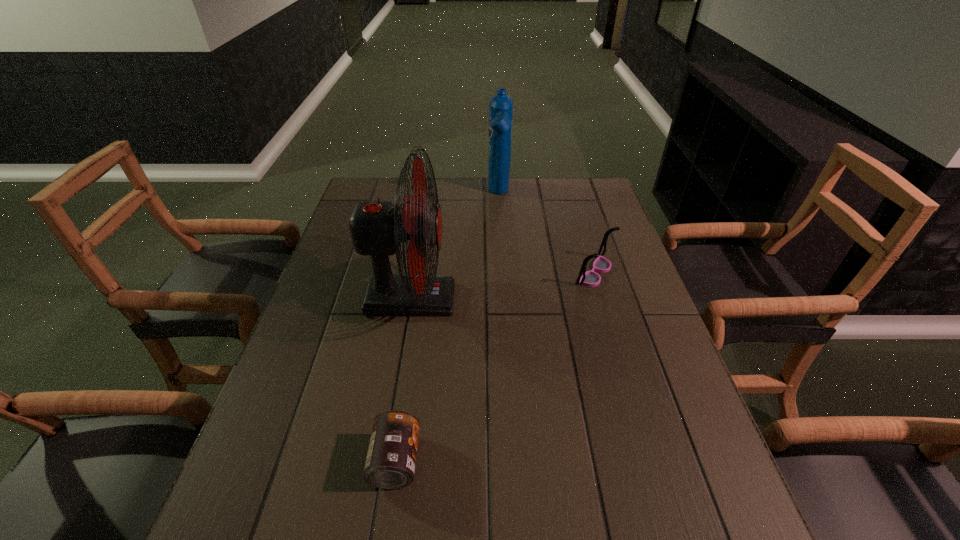
Where is `vacant space that is in between the nearest object and the tallest object`? The width and height of the screenshot is (960, 540). vacant space that is in between the nearest object and the tallest object is located at coordinates 403,380.

In order to click on free point between the fan and the nearest object in this screenshot , I will do `click(403, 380)`.

Identify the location of vacant space that's between the third tallest object and the third object from left to right. The width and height of the screenshot is (960, 540). (546, 233).

The image size is (960, 540). Identify the location of vacant area that lies between the shortest object and the farthest object. (x=447, y=327).

This screenshot has width=960, height=540. I want to click on free spot between the nearest object and the spectacles, so click(495, 367).

Find the location of a particular element. The image size is (960, 540). free space between the spectacles and the nearest object is located at coordinates (495, 367).

Locate an element on the screen. The image size is (960, 540). empty location between the second shortest object and the farthest object is located at coordinates (546, 233).

Locate an element on the screen. free space between the second object from right to left and the tallest object is located at coordinates (455, 246).

Find the location of `free space between the can and the second shortest object`. free space between the can and the second shortest object is located at coordinates (495, 367).

Identify the location of object that ranks as the second closest to the spectacles. (377, 228).